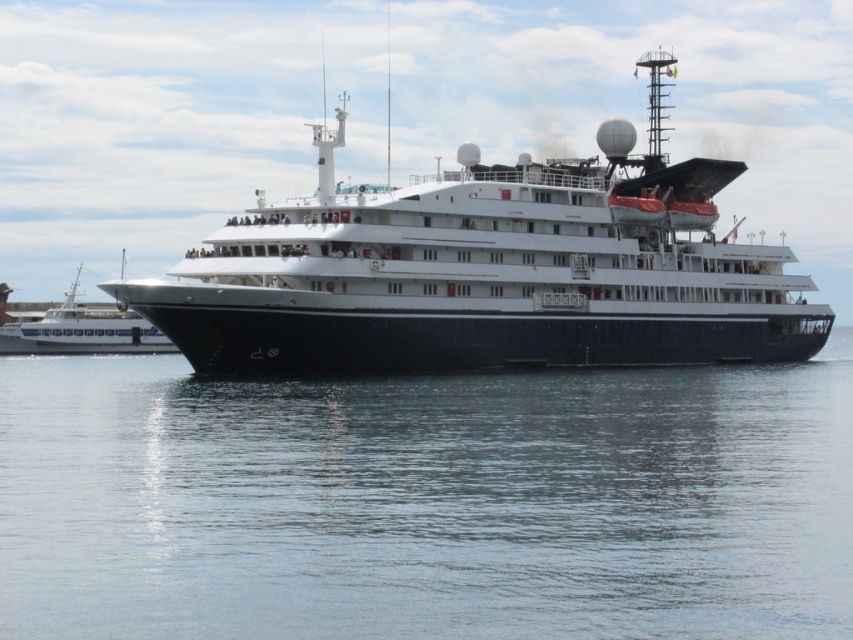
You are standing on the deck of the Corinthian cruise ship and want to reach the point marked at coordinates point (490,563). The ship has a safety regulation that requires all passengers to stay within 150 feet of the camera location. Will you be able to reach the point without violating the safety regulation?

The point (490,563) is 174.34 feet away from the camera, which exceeds the 150 feet safety regulation. Therefore, reaching the point would violate the safety regulation.

You are a photographer standing on the deck of the black glossy ship at center. You want to take a photo of the transparent water at center. Which object will appear larger in your photo?

The black glossy ship at center will appear larger in your photo because it is taller than the transparent water at center.